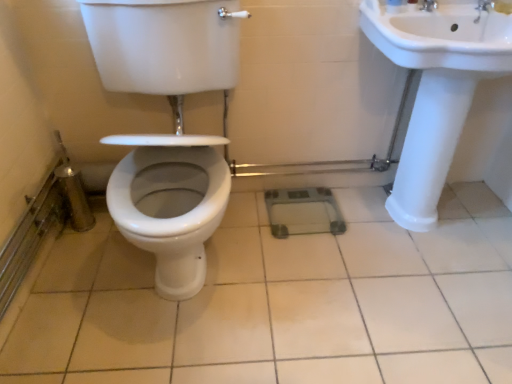
The width and height of the screenshot is (512, 384). Find the location of `vacant area on top of white glossy tile at center (from a real-world perspective)`. vacant area on top of white glossy tile at center (from a real-world perspective) is located at coordinates (259, 296).